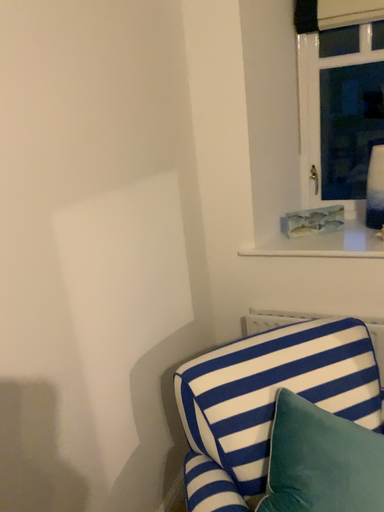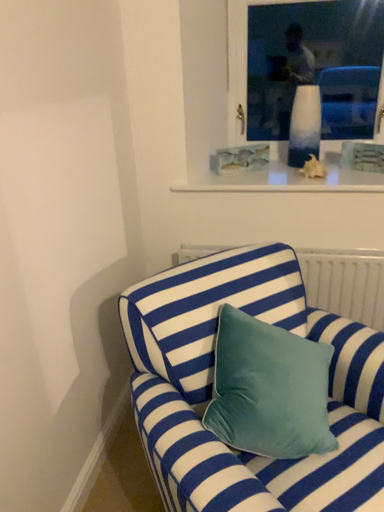
Question: Which way did the camera rotate in the video?

Choices:
 (A) rotated left
 (B) rotated right

Answer: (B)